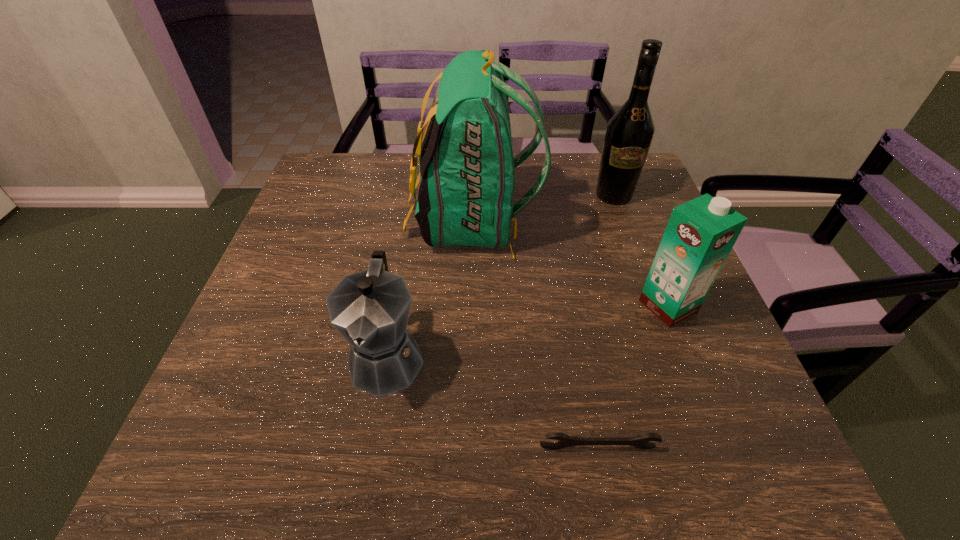
I want to click on backpack present at the far edge, so click(465, 198).

The width and height of the screenshot is (960, 540). I want to click on wine bottle that is at the far edge, so click(629, 133).

I want to click on object present at the near edge, so pyautogui.click(x=641, y=441).

Locate an element on the screen. This screenshot has height=540, width=960. wine bottle located in the right edge section of the desktop is located at coordinates (629, 133).

Where is `carton located at the right edge`? The width and height of the screenshot is (960, 540). carton located at the right edge is located at coordinates (700, 234).

Where is `object at the far right corner`? object at the far right corner is located at coordinates (629, 133).

Where is `vacant area at the near edge of the desktop`? The width and height of the screenshot is (960, 540). vacant area at the near edge of the desktop is located at coordinates (659, 445).

The width and height of the screenshot is (960, 540). What are the coordinates of `free spot at the left edge of the desktop` in the screenshot? It's located at (247, 329).

Identify the location of free spot at the right edge of the desktop. This screenshot has width=960, height=540. (651, 221).

Locate an element on the screen. The image size is (960, 540). vacant space at the far left corner is located at coordinates (365, 163).